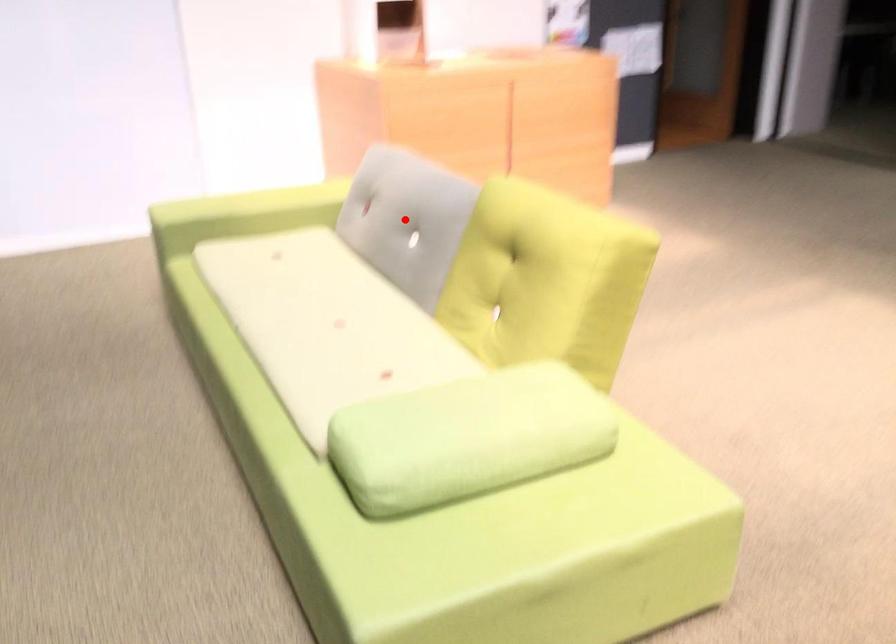
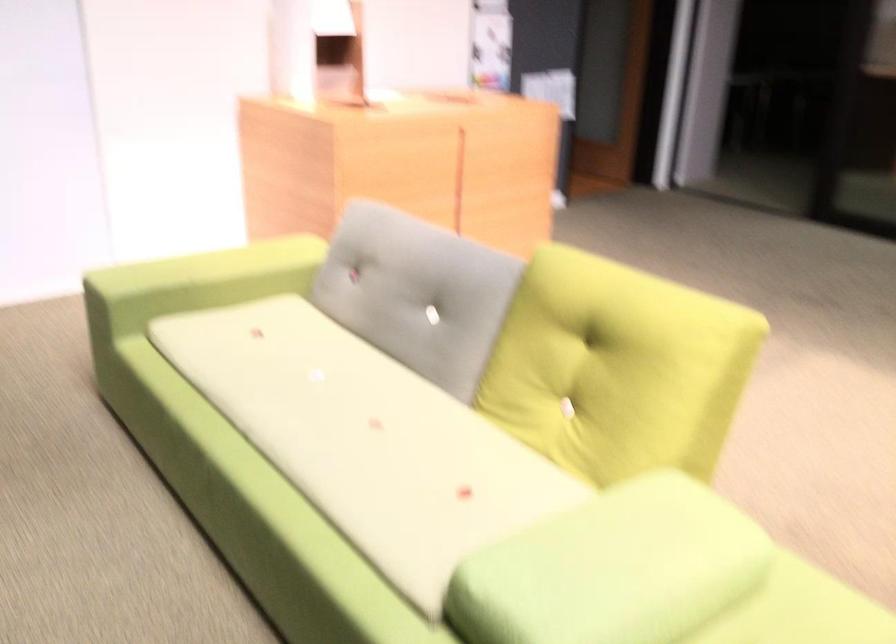
Find the pixel in the second image that matches the highlighted location in the first image.

(417, 292)